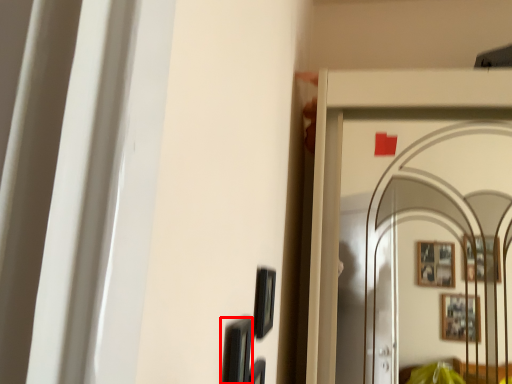
Question: From the image's perspective, what is the correct spatial positioning of picture frame (annotated by the red box) in reference to picture frame?

Choices:
 (A) above
 (B) below

Answer: (B)